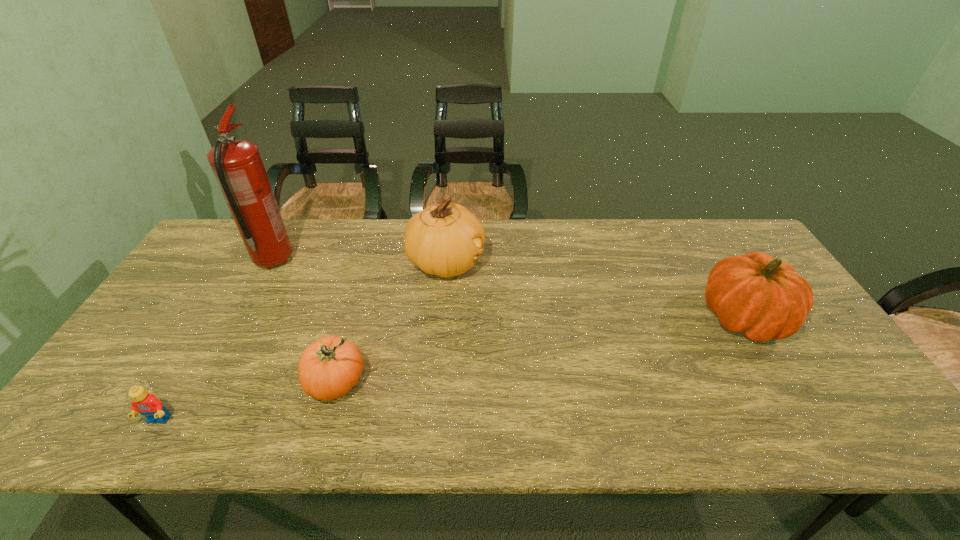
Identify the location of unoccupied area between the rightmost object and the tallest object. The image size is (960, 540). (509, 289).

What are the coordinates of `free area in between the leftmost pumpkin and the fourth object from left to right` in the screenshot? It's located at (392, 322).

I want to click on vacant region between the Lego and the leftmost pumpkin, so click(x=248, y=401).

The image size is (960, 540). Find the location of `vacant point located between the tallest object and the second pumpkin from right to left`. vacant point located between the tallest object and the second pumpkin from right to left is located at coordinates (360, 261).

The width and height of the screenshot is (960, 540). I want to click on vacant space in between the tallest object and the second pumpkin from right to left, so click(360, 261).

In order to click on object that can be found as the second closest to the shortest object in this screenshot , I will do `click(237, 165)`.

Point out which object is positioned as the third nearest to the nearest object. Please provide its 2D coordinates. Your answer should be formatted as a tuple, i.e. [(x, y)], where the tuple contains the x and y coordinates of a point satisfying the conditions above.

[(444, 240)]

Locate which pumpkin ranks in proximity to the rightmost object. Please provide its 2D coordinates. Your answer should be formatted as a tuple, i.e. [(x, y)], where the tuple contains the x and y coordinates of a point satisfying the conditions above.

[(444, 240)]

I want to click on pumpkin that stands as the second closest to the fourth object from left to right, so click(x=763, y=298).

The width and height of the screenshot is (960, 540). Identify the location of vacant space that satisfies the following two spatial constraints: 1. on the front face of the fourth object from left to right; 2. on the face of the nearest object. (432, 421).